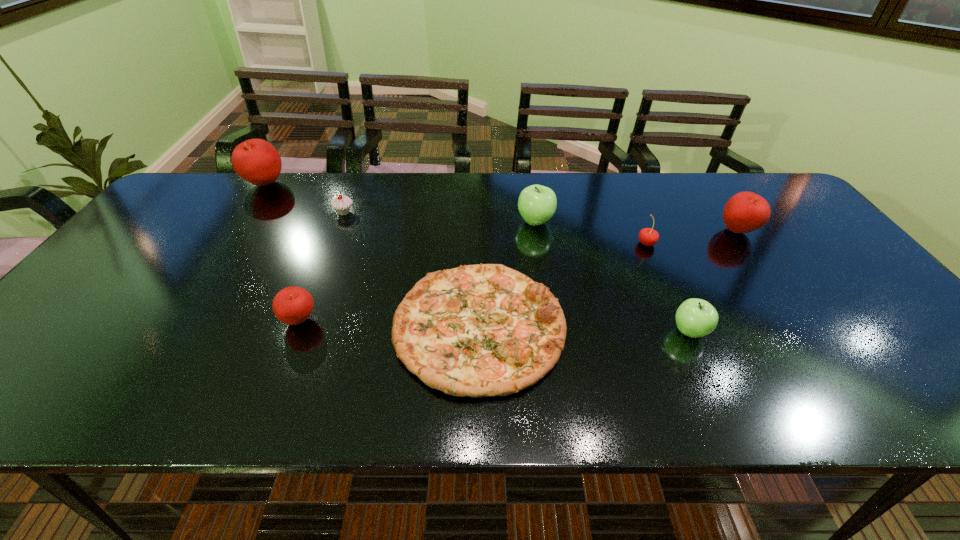
Find the location of `free region located 0.380m on the back of the nearest red apple`. free region located 0.380m on the back of the nearest red apple is located at coordinates (342, 215).

Locate an element on the screen. vacant area situated on the left of the brown pizza is located at coordinates (227, 328).

At what (x,y) coordinates should I click in order to perform the action: click on cupcake present at the far edge. Please return your answer as a coordinate pair (x, y). The width and height of the screenshot is (960, 540). Looking at the image, I should click on pyautogui.click(x=342, y=204).

The height and width of the screenshot is (540, 960). I want to click on object that is at the near edge, so click(x=485, y=330).

Identify the location of vacant space at the far edge. The image size is (960, 540). point(621,198).

This screenshot has width=960, height=540. What are the coordinates of `vacant region at the near edge of the desktop` in the screenshot? It's located at (165, 414).

Identify the location of vacant space at the left edge. (x=43, y=355).

Image resolution: width=960 pixels, height=540 pixels. In order to click on free space at the right edge in this screenshot , I will do `click(885, 342)`.

Find the location of a particular element. free space that is in between the bigger green apple and the red cherry is located at coordinates (591, 232).

Identify the location of free spot between the third apple from right to left and the rightmost object. The image size is (960, 540). (636, 226).